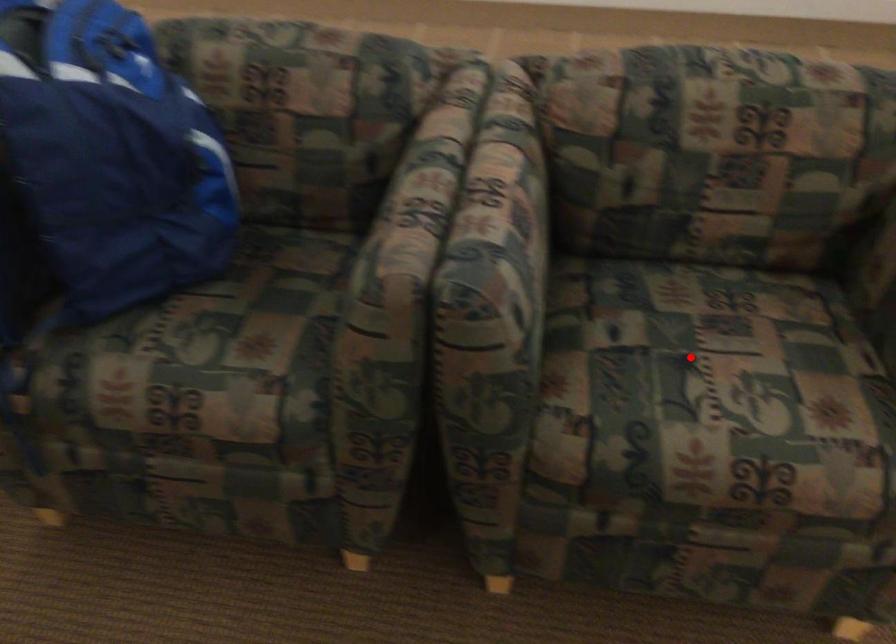
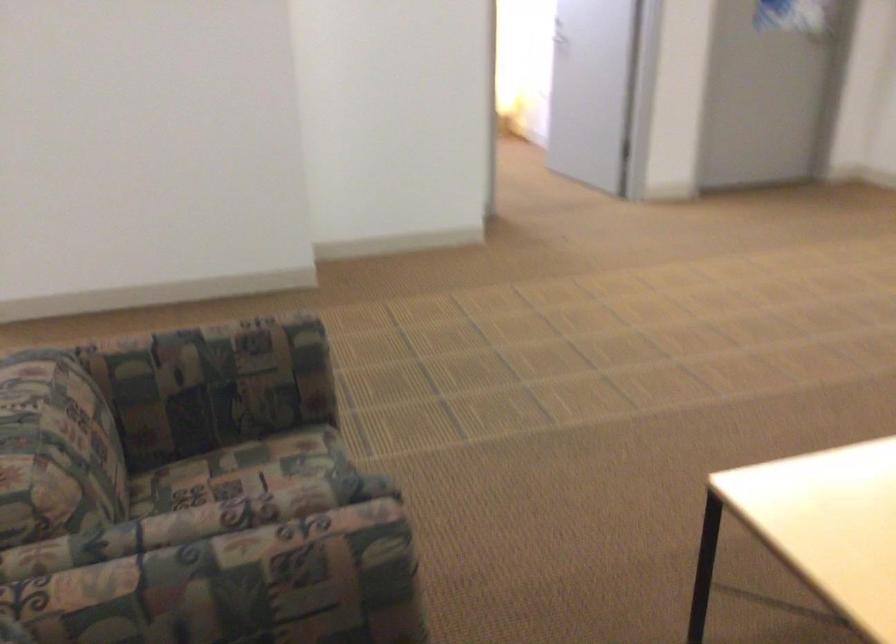
Question: I am providing you with two images of the same scene from different viewpoints. A red point is marked on the first image. At the location where the point appears in image 1, is it still visible in image 2?

Choices:
 (A) Yes
 (B) No

Answer: (B)